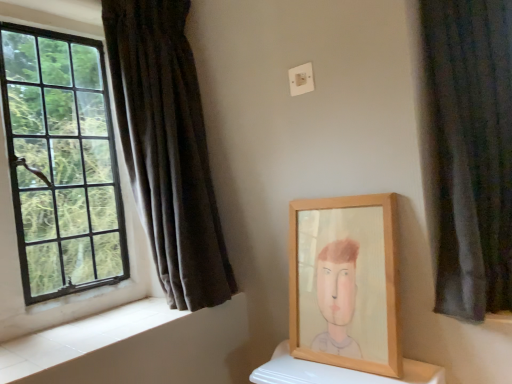
Question: Does dark velvet curtain at right, which is the 2th curtain in back-to-front order, have a larger size compared to wooden frame at center?

Choices:
 (A) no
 (B) yes

Answer: (B)

Question: From the image's perspective, is dark velvet curtain at right, the 1th curtain when ordered from right to left, on wooden frame at center?

Choices:
 (A) yes
 (B) no

Answer: (A)

Question: Does dark velvet curtain at right, arranged as the 1th curtain when viewed from the front, have a smaller size compared to wooden frame at center?

Choices:
 (A) no
 (B) yes

Answer: (A)

Question: Can you confirm if dark velvet curtain at right, the 1th curtain when ordered from right to left, is shorter than wooden frame at center?

Choices:
 (A) no
 (B) yes

Answer: (A)

Question: From the image's perspective, is dark velvet curtain at right, arranged as the 1th curtain when viewed from the front, below wooden frame at center?

Choices:
 (A) no
 (B) yes

Answer: (A)

Question: Considering their positions, is white tile at lower left located in front of or behind black glass window at left?

Choices:
 (A) front
 (B) behind

Answer: (A)

Question: Looking at the image, does white tile at lower left seem bigger or smaller compared to black glass window at left?

Choices:
 (A) big
 (B) small

Answer: (B)

Question: Visually, is white tile at lower left positioned to the left or to the right of black glass window at left?

Choices:
 (A) right
 (B) left

Answer: (A)

Question: From the image's perspective, relative to black glass window at left, is white tile at lower left above or below?

Choices:
 (A) below
 (B) above

Answer: (A)

Question: Is white tile at lower left in front of or behind wooden frame at center in the image?

Choices:
 (A) front
 (B) behind

Answer: (A)

Question: Which is correct: white tile at lower left is inside wooden frame at center, or outside of it?

Choices:
 (A) outside
 (B) inside

Answer: (A)

Question: From the image's perspective, relative to wooden frame at center, is white tile at lower left above or below?

Choices:
 (A) below
 (B) above

Answer: (A)

Question: Does point (158, 340) appear closer or farther from the camera than point (393, 243)?

Choices:
 (A) closer
 (B) farther

Answer: (B)

Question: Is dark velvet curtain at right, arranged as the 1th curtain when viewed from the front, inside or outside of wooden frame at center?

Choices:
 (A) inside
 (B) outside

Answer: (B)

Question: From a real-world perspective, relative to wooden frame at center, is dark velvet curtain at right, arranged as the 1th curtain when viewed from the front, vertically above or below?

Choices:
 (A) below
 (B) above

Answer: (B)